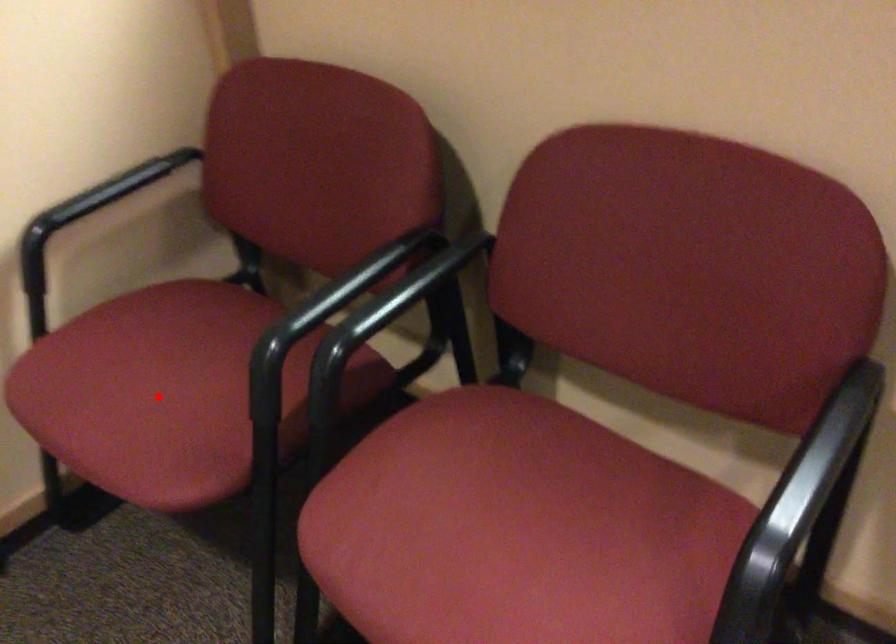
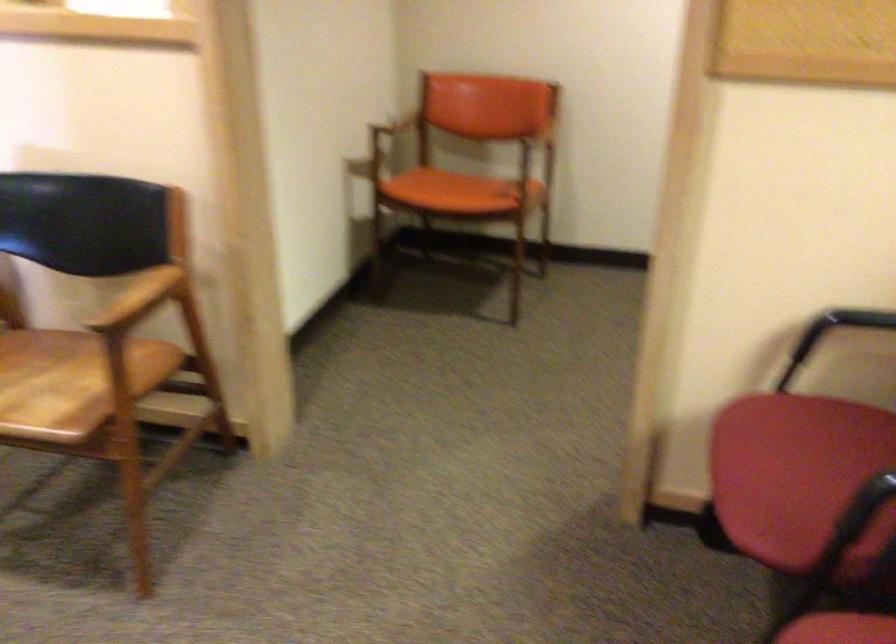
Question: I am providing you with two images of the same scene from different viewpoints. Image1 has a red point marked. In image2, the corresponding 3D location appears at what relative position? Reply with the corresponding letter.

Choices:
 (A) Closer
 (B) Farther

Answer: (B)